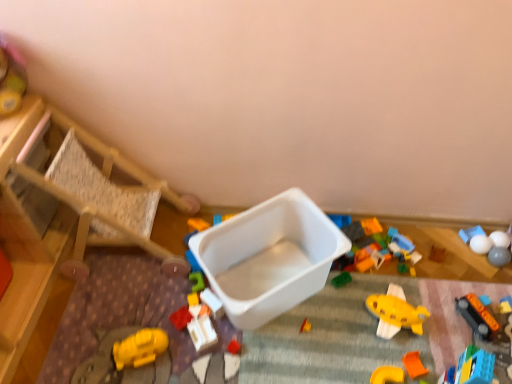
Where is `free space that is in between orange plastic train at lower right, which is the 5th toy in right-to-left order, and orange matte block at lower right, arranged as the eighth toy when viewed from the left`? free space that is in between orange plastic train at lower right, which is the 5th toy in right-to-left order, and orange matte block at lower right, arranged as the eighth toy when viewed from the left is located at coordinates (441, 343).